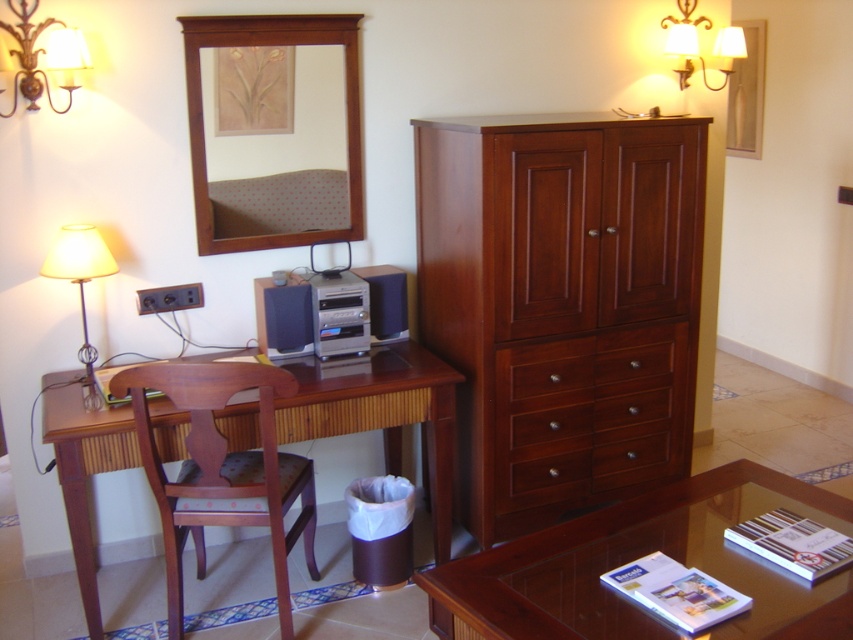
Question: Can you confirm if wooden mirror at upper center is positioned below brown wood drawer at center right?

Choices:
 (A) no
 (B) yes

Answer: (A)

Question: Among these objects, which one is nearest to the camera?

Choices:
 (A) matte gold wall sconce at upper right
 (B) mahogany wood chair at left
 (C) glossy wood coffee table at lower right
 (D) matte black speaker at center

Answer: (C)

Question: Can you confirm if mahogany wood chair at left is thinner than matte black speaker at center?

Choices:
 (A) yes
 (B) no

Answer: (B)

Question: Among these points, which one is nearest to the camera?

Choices:
 (A) (305, 484)
 (B) (370, 308)
 (C) (426, 326)

Answer: (A)

Question: Which of these objects is positioned farthest from the matte gold wall sconce at upper left?

Choices:
 (A) matte white lampshade at left
 (B) matte black speaker at center

Answer: (B)

Question: Considering the relative positions of wooden desk at center and satin black speaker at center in the image provided, where is wooden desk at center located with respect to satin black speaker at center?

Choices:
 (A) above
 (B) below

Answer: (B)